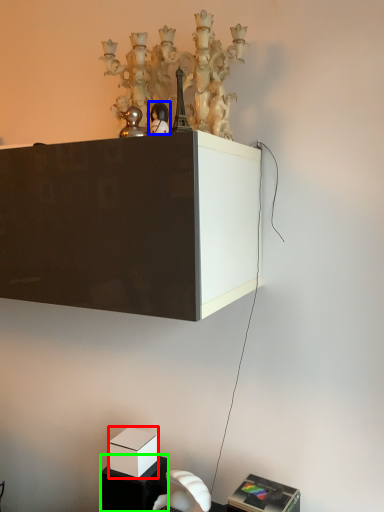
Question: Which is nearer to the box (highlighted by a red box)? toy (highlighted by a blue box) or furniture (highlighted by a green box).

Choices:
 (A) toy
 (B) furniture

Answer: (B)